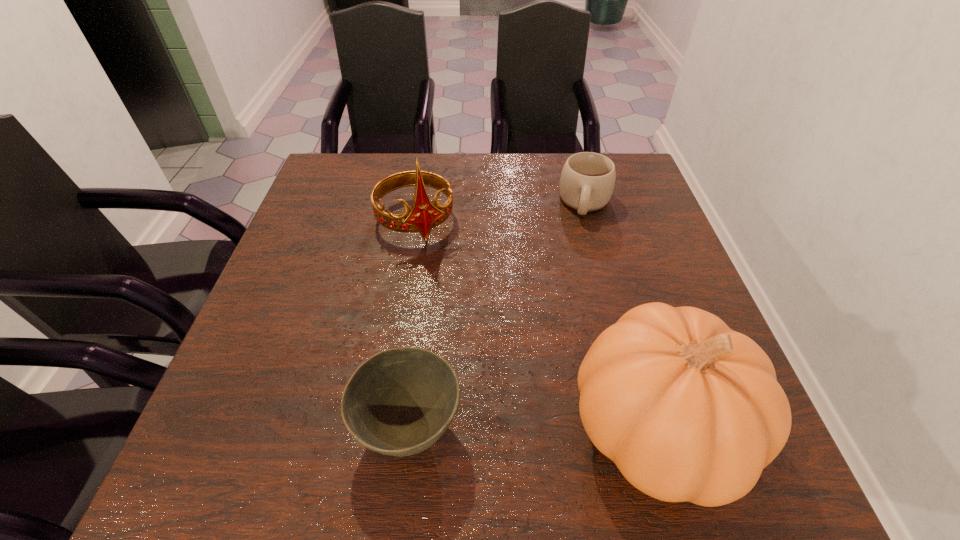
Identify the location of vacant space that is in between the tiara and the pumpkin. (537, 325).

At what (x,y) coordinates should I click in order to perform the action: click on vacant region between the bowl and the pumpkin. Please return your answer as a coordinate pair (x, y). This screenshot has height=540, width=960. Looking at the image, I should click on (533, 429).

The image size is (960, 540). Identify the location of empty space between the pumpkin and the bowl. (533, 429).

What are the coordinates of `vacant area that lies between the mug and the bowl` in the screenshot? It's located at (497, 315).

Image resolution: width=960 pixels, height=540 pixels. In order to click on vacant area between the mug and the tiara in this screenshot , I will do `click(500, 212)`.

Identify which object is located as the third nearest to the tiara. Please provide its 2D coordinates. Your answer should be formatted as a tuple, i.e. [(x, y)], where the tuple contains the x and y coordinates of a point satisfying the conditions above.

[(689, 410)]

Locate which object is the second closest to the tiara. Please provide its 2D coordinates. Your answer should be formatted as a tuple, i.e. [(x, y)], where the tuple contains the x and y coordinates of a point satisfying the conditions above.

[(399, 402)]

At what (x,y) coordinates should I click in order to perform the action: click on vacant space that satisfies the following two spatial constraints: 1. on the back side of the mug; 2. on the left side of the bowl. Please return your answer as a coordinate pair (x, y). This screenshot has width=960, height=540. Looking at the image, I should click on (436, 203).

Where is `free point that satisfies the following two spatial constraints: 1. on the back side of the mug; 2. on the left side of the bowl`? The height and width of the screenshot is (540, 960). free point that satisfies the following two spatial constraints: 1. on the back side of the mug; 2. on the left side of the bowl is located at coordinates (436, 203).

In order to click on free space that satisfies the following two spatial constraints: 1. on the back side of the mug; 2. on the left side of the tiara in this screenshot , I will do `click(419, 203)`.